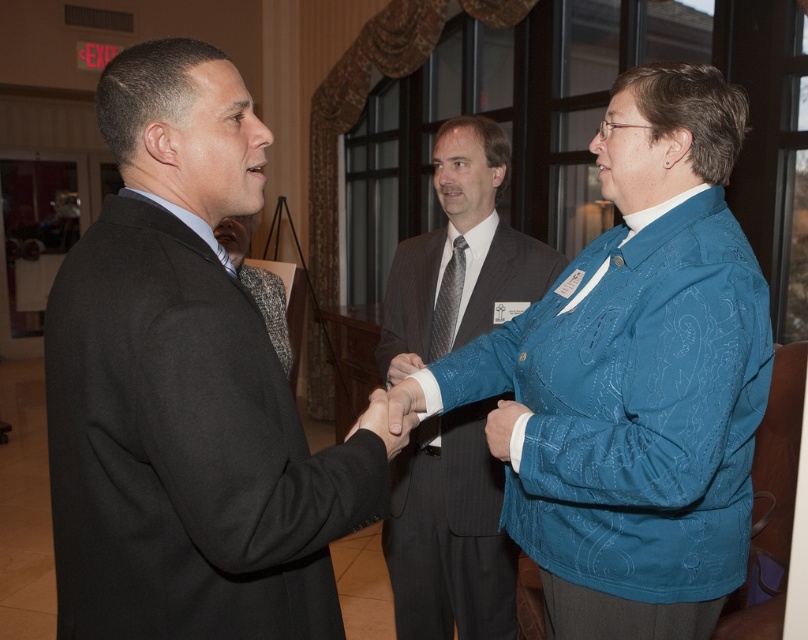
Between gray textured tie at center and blue fabric sleeve at center, which one is positioned higher?

gray textured tie at center is above.

Who is more forward, (449,292) or (505,422)?

Positioned in front is point (505,422).

Who is more distant from viewer, (440, 276) or (516, 403)?

Positioned behind is point (440, 276).

Locate an element on the screen. This screenshot has height=640, width=808. gray textured tie at center is located at coordinates click(447, 301).

Can you confirm if black suit at center is positioned to the right of dark gray pinstripe suit at center?

Incorrect, black suit at center is not on the right side of dark gray pinstripe suit at center.

Between black suit at center and dark gray pinstripe suit at center, which one has more height?

With more height is dark gray pinstripe suit at center.

Where is `black suit at center`? The image size is (808, 640). black suit at center is located at coordinates (184, 388).

Does matte black suit at center appear on the left side of gray tweed suit at center?

Incorrect, matte black suit at center is not on the left side of gray tweed suit at center.

Between matte black suit at center and gray tweed suit at center, which one is positioned higher?

gray tweed suit at center is above.

In order to click on matte black suit at center in this screenshot , I will do `click(634, 378)`.